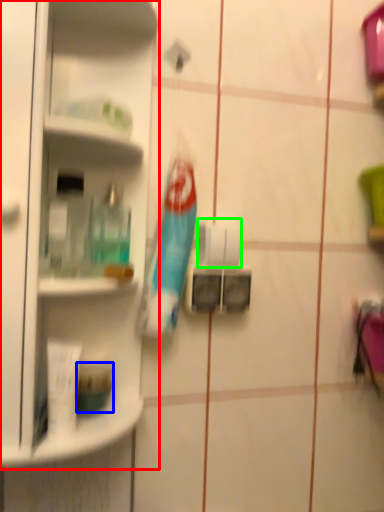
Question: Based on their relative distances, which object is nearer to shelf (highlighted by a red box)? Choose from toiletry (highlighted by a blue box) and toilet paper (highlighted by a green box).

Choices:
 (A) toiletry
 (B) toilet paper

Answer: (B)